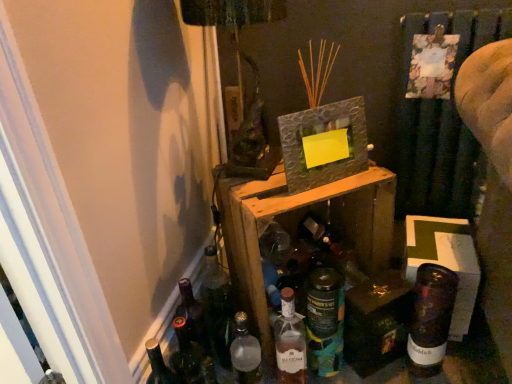
What is the approximate width of matte glass bottle at center, which is the 3th bottle from right to left?

matte glass bottle at center, which is the 3th bottle from right to left, is 3.49 inches in width.

What is the approximate width of translucent glass bottle at center, arranged as the second bottle when viewed from the right?

It is 4.21 inches.

Based on the photo, measure the distance between point (254,349) and camera.

They are 3.43 feet apart.

You are a GUI agent. You are given a task and a screenshot of the screen. Output one action in this format:
    pyautogui.click(x=<x>, y=<y>)
    Task: Click on the shiny dark brown bottle at lower right, the first bottle in the right-to-left sequence
    
    Given the screenshot: What is the action you would take?
    pyautogui.click(x=430, y=319)

Find the location of a particular element. matte glass bottle at center, which is the second bottle in left-to-right order is located at coordinates (290, 342).

Does translucent glass bottle at center, arranged as the second bottle when viewed from the right, have a smaller size compared to wooden crate at center?

Yes.

Is translucent glass bottle at center, arranged as the second bottle when viewed from the right, located outside wooden crate at center?

translucent glass bottle at center, arranged as the second bottle when viewed from the right, is positioned outside wooden crate at center.

Between translucent glass bottle at center, arranged as the 3th bottle when viewed from the left, and wooden crate at center, which one has less height?

With less height is translucent glass bottle at center, arranged as the 3th bottle when viewed from the left.

Which object is further away from the camera taking this photo, translucent glass bottle at center, arranged as the second bottle when viewed from the right, or wooden crate at center?

translucent glass bottle at center, arranged as the second bottle when viewed from the right, is more distant.

Consider the image. In the image, is matte glass bottle at center, which is the second bottle in left-to-right order, positioned in front of or behind cardboard box at lower right?

In the image, matte glass bottle at center, which is the second bottle in left-to-right order, appears in front of cardboard box at lower right.

From the image's perspective, who appears lower, matte glass bottle at center, which is the second bottle in left-to-right order, or cardboard box at lower right?

From the image's view, matte glass bottle at center, which is the second bottle in left-to-right order, is below.

Is matte glass bottle at center, which is the second bottle in left-to-right order, oriented towards cardboard box at lower right?

No.

Considering the relative positions of matte glass bottle at center, which is the second bottle in left-to-right order, and cardboard box at lower right in the image provided, is matte glass bottle at center, which is the second bottle in left-to-right order, to the right of cardboard box at lower right from the viewer's perspective?

In fact, matte glass bottle at center, which is the second bottle in left-to-right order, is to the left of cardboard box at lower right.

Looking at their sizes, would you say wooden crate at center is wider or thinner than cardboard box at lower right?

Considering their sizes, wooden crate at center looks broader than cardboard box at lower right.

Which is behind, point (261, 286) or point (406, 261)?

The point (406, 261) is more distant.

From the image's perspective, which is below, wooden crate at center or cardboard box at lower right?

From the image's view, cardboard box at lower right is below.

From the image's perspective, is matte glass bottle at center, which is the 3th bottle from right to left, above or below wooden crate at center?

Clearly, from the image's perspective, matte glass bottle at center, which is the 3th bottle from right to left, is below wooden crate at center.

Is matte glass bottle at center, which is the second bottle in left-to-right order, far away from wooden crate at center?

They are positioned close to each other.

Is the position of matte glass bottle at center, which is the second bottle in left-to-right order, less distant than that of wooden crate at center?

No, matte glass bottle at center, which is the second bottle in left-to-right order, is further to the viewer.

Does point (298, 364) appear closer or farther from the camera than point (370, 230)?

Point (298, 364) is closer to the camera than point (370, 230).

Can you confirm if shiny dark brown bottle at lower right, the first bottle in the right-to-left sequence, is wider than matte glass bottle at center, which is the second bottle in left-to-right order?

Yes, shiny dark brown bottle at lower right, the first bottle in the right-to-left sequence, is wider than matte glass bottle at center, which is the second bottle in left-to-right order.

Is shiny dark brown bottle at lower right, the first bottle in the right-to-left sequence, smaller than matte glass bottle at center, which is the second bottle in left-to-right order?

Actually, shiny dark brown bottle at lower right, the first bottle in the right-to-left sequence, might be larger than matte glass bottle at center, which is the second bottle in left-to-right order.

Considering the positions of objects shiny dark brown bottle at lower right, the first bottle in the right-to-left sequence, and matte glass bottle at center, which is the 3th bottle from right to left, in the image provided, who is behind, shiny dark brown bottle at lower right, the first bottle in the right-to-left sequence, or matte glass bottle at center, which is the 3th bottle from right to left,?

matte glass bottle at center, which is the 3th bottle from right to left, is more distant.

Is shiny dark brown bottle at lower right, the first bottle in the right-to-left sequence, next to matte glass bottle at center, which is the second bottle in left-to-right order, and touching it?

There is a gap between shiny dark brown bottle at lower right, the first bottle in the right-to-left sequence, and matte glass bottle at center, which is the second bottle in left-to-right order.

Does cardboard box at lower right have a greater height compared to shiny metallic box at lower right?

Correct, cardboard box at lower right is much taller as shiny metallic box at lower right.

From a real-world perspective, between cardboard box at lower right and shiny metallic box at lower right, who is vertically higher?

From a 3D spatial view, cardboard box at lower right is above.

Is point (433, 257) closer or farther from the camera than point (397, 353)?

Point (433, 257) appears to be closer to the viewer than point (397, 353).

Between shiny metallic box at lower right and matte glass bottle at center, which is the second bottle in left-to-right order, which one has more height?

Standing taller between the two is matte glass bottle at center, which is the second bottle in left-to-right order.

Does shiny metallic box at lower right come behind matte glass bottle at center, which is the 3th bottle from right to left?

Yes.

From a real-world perspective, is shiny metallic box at lower right physically above matte glass bottle at center, which is the 3th bottle from right to left?

Actually, shiny metallic box at lower right is physically below matte glass bottle at center, which is the 3th bottle from right to left, in the real world.

Considering the relative sizes of shiny metallic box at lower right and matte glass bottle at center, which is the second bottle in left-to-right order, in the image provided, is shiny metallic box at lower right bigger than matte glass bottle at center, which is the second bottle in left-to-right order,?

Correct, shiny metallic box at lower right is larger in size than matte glass bottle at center, which is the second bottle in left-to-right order.

Starting from the wooden crate at center, which bottle is the 3rd one behind? Please provide its 2D coordinates.

[(325, 321)]

Find the location of `cardboard box to the right of matte glass bottle at center, which is the 3th bottle from right to left`. cardboard box to the right of matte glass bottle at center, which is the 3th bottle from right to left is located at coordinates (446, 261).

When comparing their distances from textured gray picture frame at upper center, does translucent glass bottle at center, arranged as the 3th bottle when viewed from the left, or shiny dark brown bottle at lower right, marked as the 4th bottle in a left-to-right arrangement, seem closer?

translucent glass bottle at center, arranged as the 3th bottle when viewed from the left, is closer to textured gray picture frame at upper center.

Estimate the real-world distances between objects in this image. Which object is closer to shiny dark brown bottle at lower right, the first bottle in the right-to-left sequence, wooden crate at center or shiny metallic box at lower right?

shiny metallic box at lower right is closer to shiny dark brown bottle at lower right, the first bottle in the right-to-left sequence.

Considering their positions, is shiny dark brown bottle at lower right, the first bottle in the right-to-left sequence, positioned further to cardboard box at lower right than translucent glass bottle at center, arranged as the second bottle when viewed from the right?

translucent glass bottle at center, arranged as the second bottle when viewed from the right, lies further to cardboard box at lower right than the other object.

From the image, which object appears to be nearer to translucent glass bottle at center, which is the 1th bottle in left-to-right order, textured gray picture frame at upper center or translucent glass bottle at center, arranged as the 3th bottle when viewed from the left?

translucent glass bottle at center, arranged as the 3th bottle when viewed from the left, is positioned closer to the anchor translucent glass bottle at center, which is the 1th bottle in left-to-right order.

From the picture: When comparing their distances from shiny dark brown bottle at lower right, marked as the 4th bottle in a left-to-right arrangement, does matte glass bottle at center, which is the 3th bottle from right to left, or cardboard box at lower right seem closer?

cardboard box at lower right is positioned closer to the anchor shiny dark brown bottle at lower right, marked as the 4th bottle in a left-to-right arrangement.

When comparing their distances from cardboard box at lower right, does translucent glass bottle at center, arranged as the second bottle when viewed from the right, or textured gray picture frame at upper center seem further?

textured gray picture frame at upper center lies further to cardboard box at lower right than the other object.

When comparing their distances from wooden crate at center, does shiny dark brown bottle at lower right, the first bottle in the right-to-left sequence, or translucent glass bottle at center, arranged as the 3th bottle when viewed from the left, seem closer?

translucent glass bottle at center, arranged as the 3th bottle when viewed from the left, is positioned closer to the anchor wooden crate at center.

When comparing their distances from matte glass bottle at center, which is the second bottle in left-to-right order, does shiny metallic box at lower right or cardboard box at lower right seem further?

cardboard box at lower right.

What are the coordinates of `box situated between translucent glass bottle at center, arranged as the 3th bottle when viewed from the left, and shiny dark brown bottle at lower right, marked as the 4th bottle in a left-to-right arrangement, from left to right` in the screenshot? It's located at (376, 322).

Find the location of `bottle between textured gray picture frame at upper center and translucent glass bottle at center, arranged as the second bottle when viewed from the right, from top to bottom`. bottle between textured gray picture frame at upper center and translucent glass bottle at center, arranged as the second bottle when viewed from the right, from top to bottom is located at coordinates (430, 319).

You are a GUI agent. You are given a task and a screenshot of the screen. Output one action in this format:
    pyautogui.click(x=<x>, y=<y>)
    Task: Click on the box situated between matte glass bottle at center, which is the 3th bottle from right to left, and shiny dark brown bottle at lower right, the first bottle in the right-to-left sequence, from left to right
    
    Given the screenshot: What is the action you would take?
    pyautogui.click(x=376, y=322)

What are the coordinates of `furniture located between translucent glass bottle at center, which is the 1th bottle in left-to-right order, and shiny dark brown bottle at lower right, the first bottle in the right-to-left sequence, in the left-right direction` in the screenshot? It's located at (298, 225).